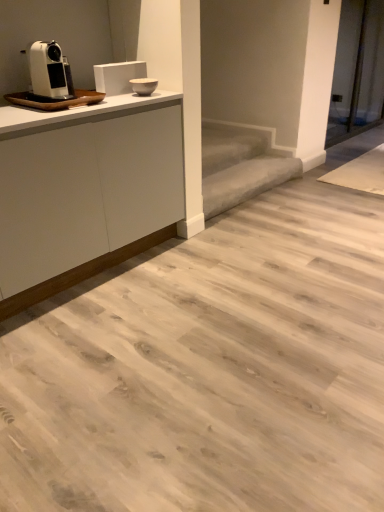
Question: Does gray carpeted stair at center have a greater width compared to white plastic coffee machine at left?

Choices:
 (A) no
 (B) yes

Answer: (B)

Question: From the image's perspective, does gray carpeted stair at center appear lower than white plastic coffee machine at left?

Choices:
 (A) yes
 (B) no

Answer: (A)

Question: Can you confirm if gray carpeted stair at center is smaller than white plastic coffee machine at left?

Choices:
 (A) no
 (B) yes

Answer: (A)

Question: Considering the relative sizes of gray carpeted stair at center and white plastic coffee machine at left in the image provided, is gray carpeted stair at center shorter than white plastic coffee machine at left?

Choices:
 (A) no
 (B) yes

Answer: (B)

Question: Does gray carpeted stair at center come in front of white plastic coffee machine at left?

Choices:
 (A) no
 (B) yes

Answer: (A)

Question: Can you confirm if gray carpeted stair at center is taller than white plastic coffee machine at left?

Choices:
 (A) yes
 (B) no

Answer: (B)

Question: Is the depth of white plastic coffee machine at left greater than that of white matte cabinet at upper left?

Choices:
 (A) yes
 (B) no

Answer: (A)

Question: Is white plastic coffee machine at left taller than white matte cabinet at upper left?

Choices:
 (A) no
 (B) yes

Answer: (A)

Question: Is white plastic coffee machine at left not inside white matte cabinet at upper left?

Choices:
 (A) yes
 (B) no

Answer: (A)

Question: Does white plastic coffee machine at left have a lesser width compared to white matte cabinet at upper left?

Choices:
 (A) yes
 (B) no

Answer: (A)

Question: Does white plastic coffee machine at left have a lesser height compared to white matte cabinet at upper left?

Choices:
 (A) no
 (B) yes

Answer: (B)

Question: Is white plastic coffee machine at left bigger than white matte cabinet at upper left?

Choices:
 (A) no
 (B) yes

Answer: (A)

Question: Is gray carpeted stair at center wider than white matte cabinet at upper left?

Choices:
 (A) yes
 (B) no

Answer: (B)